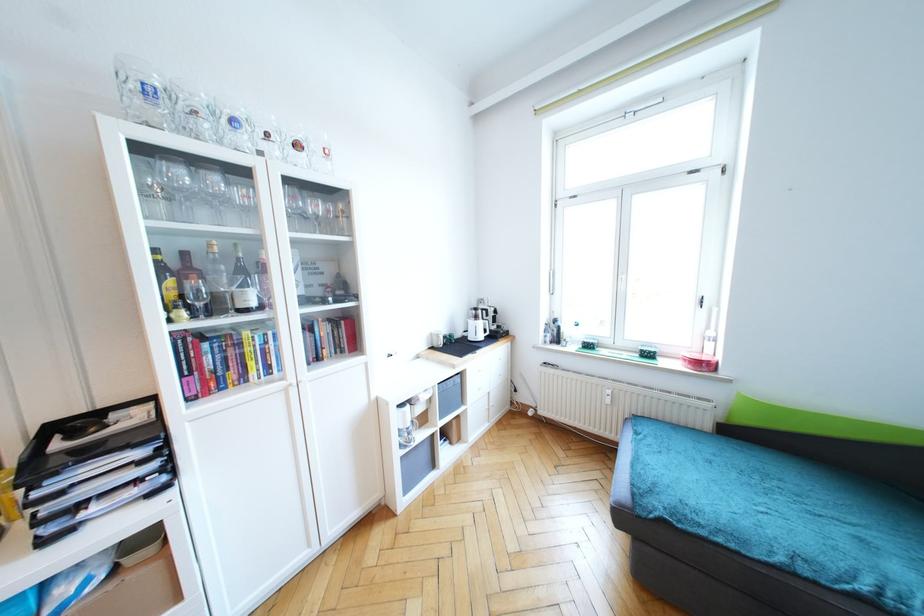
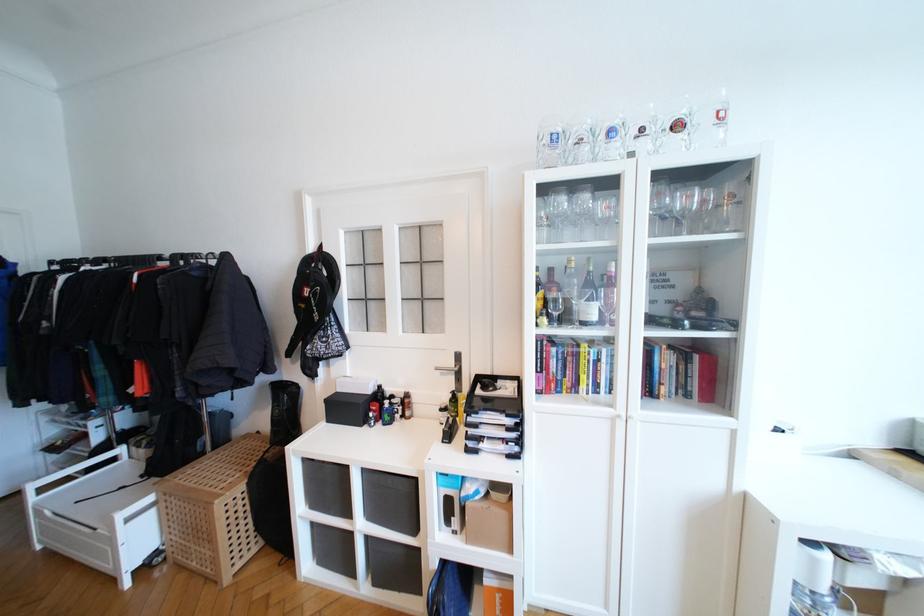
Where in the second image is the point corresponding to (202,306) from the first image?

(558, 315)